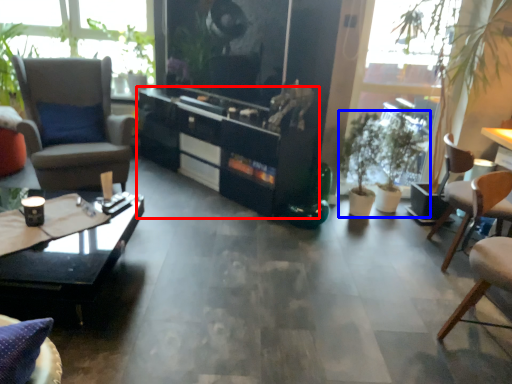
Question: Which of the following is the farthest to the observer, cabinetry (highlighted by a red box) or houseplant (highlighted by a blue box)?

Choices:
 (A) cabinetry
 (B) houseplant

Answer: (B)